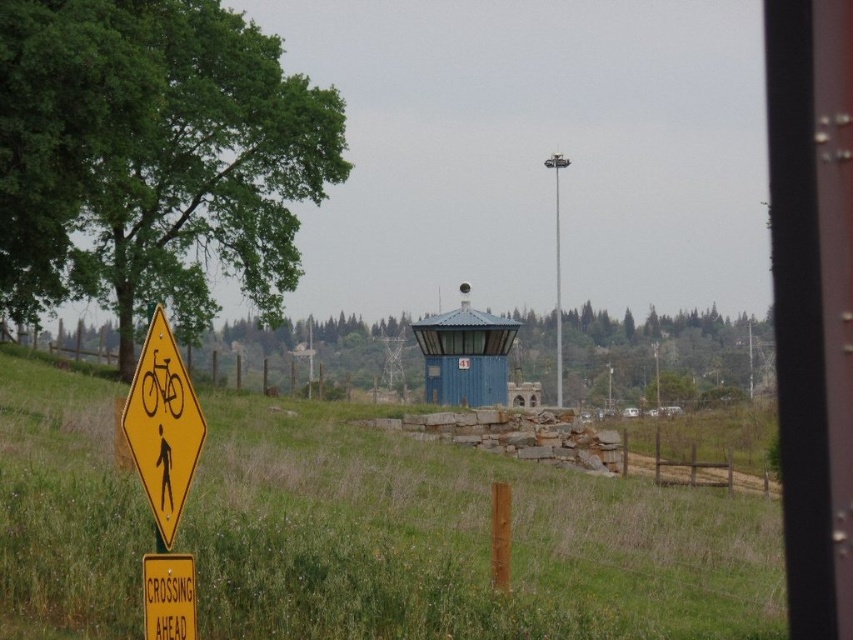
Who is lower down, green grassy at lower left or brushed metal pole at upper center?

green grassy at lower left

Does point (305, 413) come in front of point (555, 317)?

Yes, point (305, 413) is in front of point (555, 317).

Describe the element at coordinates (456, 540) in the screenshot. I see `green grassy at lower left` at that location.

The width and height of the screenshot is (853, 640). I want to click on green grassy at lower left, so click(456, 540).

Which is more to the left, yellow plastic diamond at left or blue matte hut at center?

yellow plastic diamond at left is more to the left.

Who is taller, yellow plastic diamond at left or blue matte hut at center?

blue matte hut at center is taller.

Between point (165, 424) and point (497, 355), which one is positioned behind?

The point (497, 355) is behind.

The height and width of the screenshot is (640, 853). Find the location of `yellow plastic diamond at left`. yellow plastic diamond at left is located at coordinates (161, 428).

Is green grassy at lower left shorter than yellow plastic sign at lower left?

Incorrect, green grassy at lower left's height does not fall short of yellow plastic sign at lower left's.

Does green grassy at lower left have a smaller size compared to yellow plastic sign at lower left?

Incorrect, green grassy at lower left is not smaller in size than yellow plastic sign at lower left.

Image resolution: width=853 pixels, height=640 pixels. What do you see at coordinates (456, 540) in the screenshot?
I see `green grassy at lower left` at bounding box center [456, 540].

In order to click on green grassy at lower left in this screenshot , I will do `click(456, 540)`.